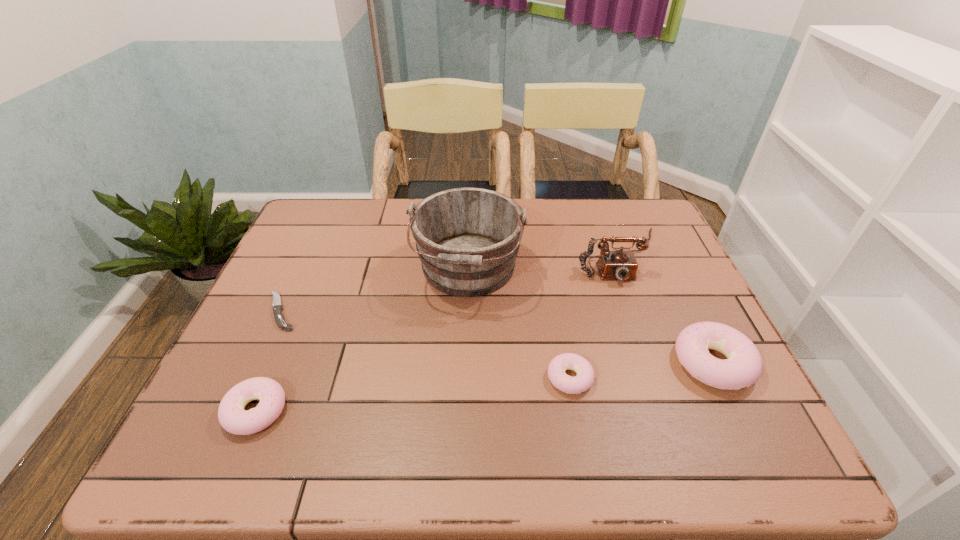
Identify which doughnut is the closest to the second tallest object. Please provide its 2D coordinates. Your answer should be formatted as a tuple, i.e. [(x, y)], where the tuple contains the x and y coordinates of a point satisfying the conditions above.

[(742, 368)]

Identify which doughnut is the second closest to the third tallest object. Please provide its 2D coordinates. Your answer should be formatted as a tuple, i.e. [(x, y)], where the tuple contains the x and y coordinates of a point satisfying the conditions above.

[(233, 418)]

I want to click on free space in the image that satisfies the following two spatial constraints: 1. on the back side of the shortest object; 2. on the right side of the tallest object, so click(301, 269).

What are the coordinates of `free location that satisfies the following two spatial constraints: 1. on the back side of the pocketknife; 2. on the right side of the third object from left to right` in the screenshot? It's located at (301, 269).